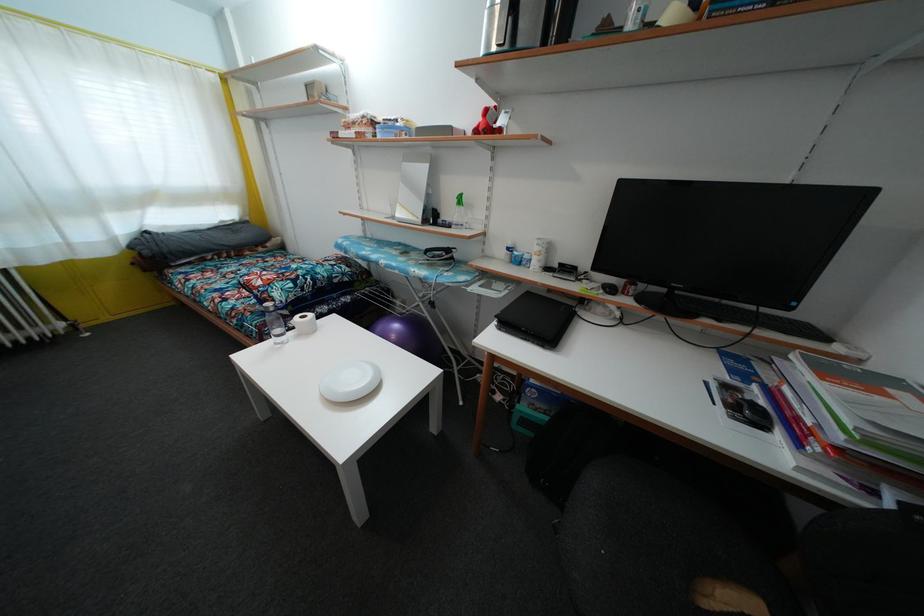
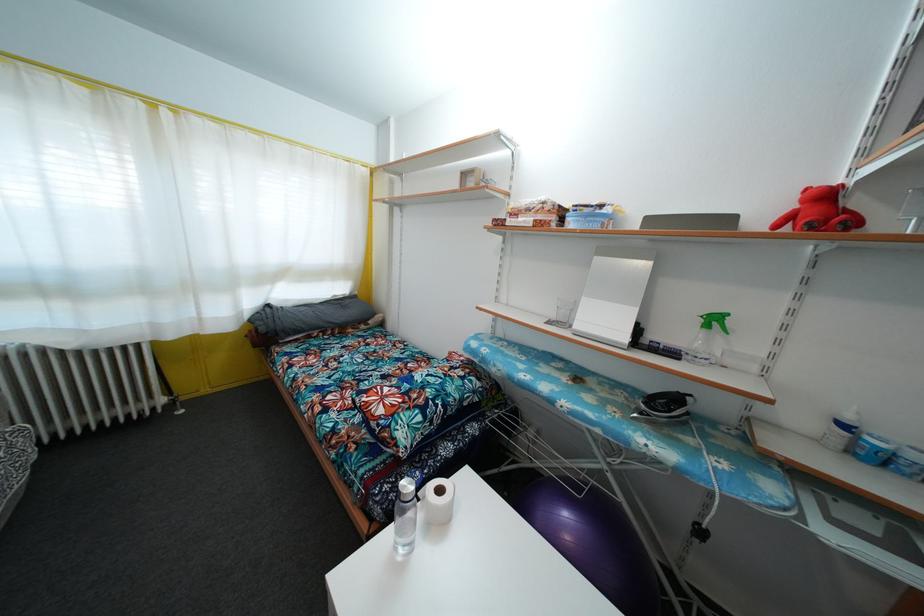
Find the pixel in the second image that matches point (435, 310) in the first image.

(704, 540)